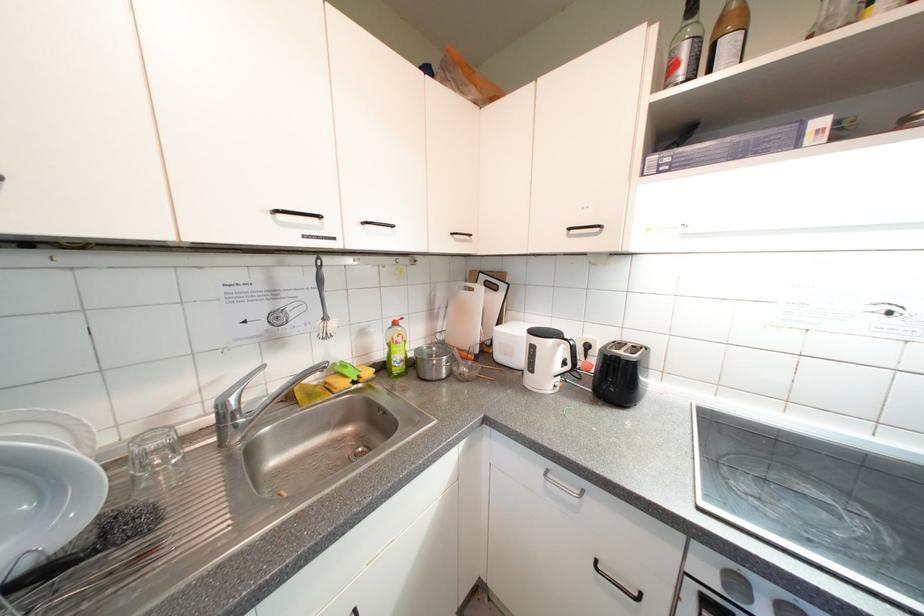
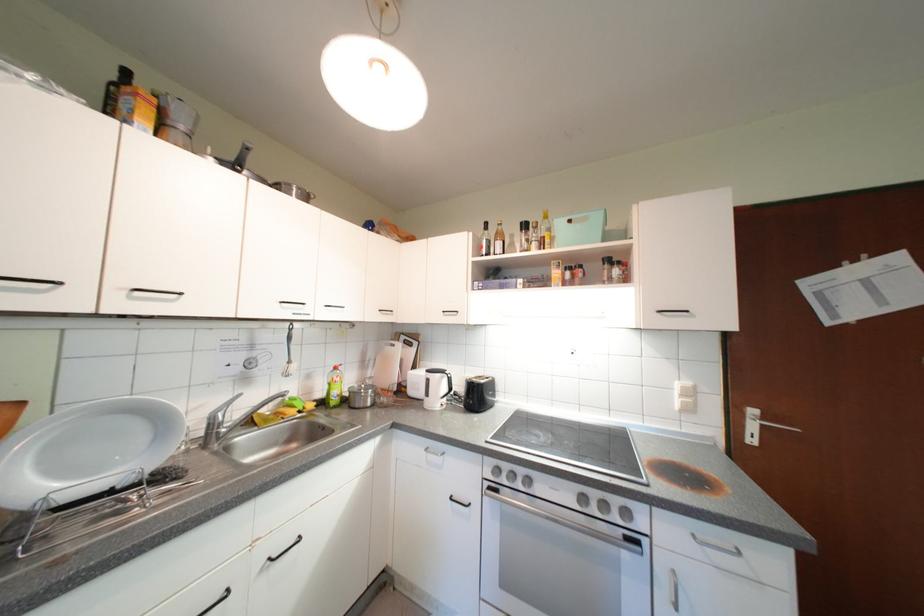
Find the pixel in the second image that matches [373,225] in the first image.

(335, 309)